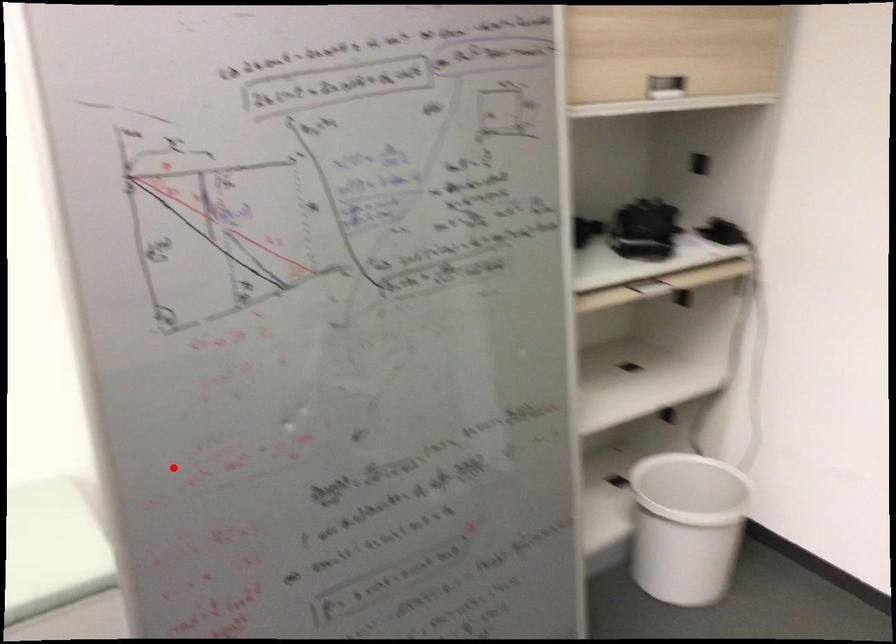
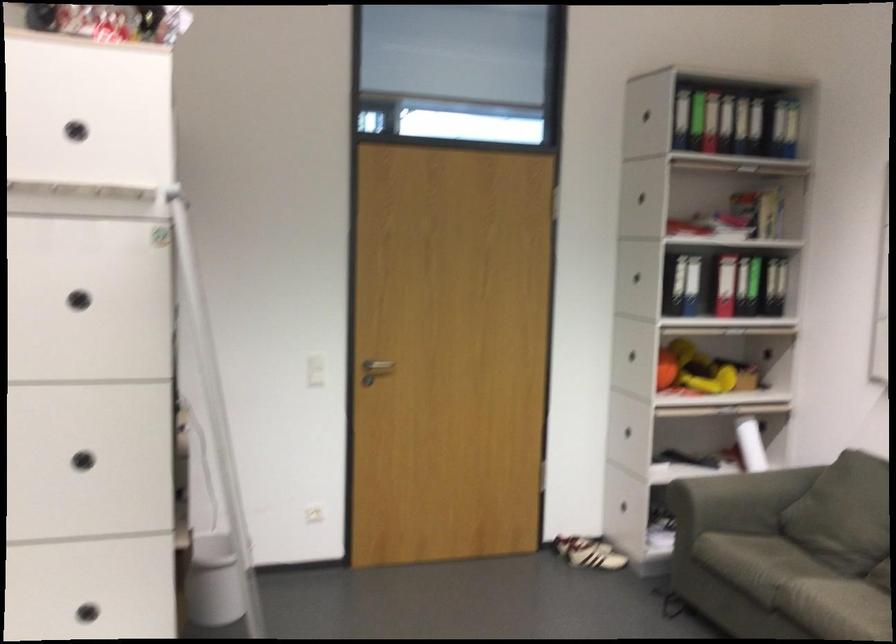
In the second image, find the point that corresponds to the highlighted location in the first image.

(96, 598)